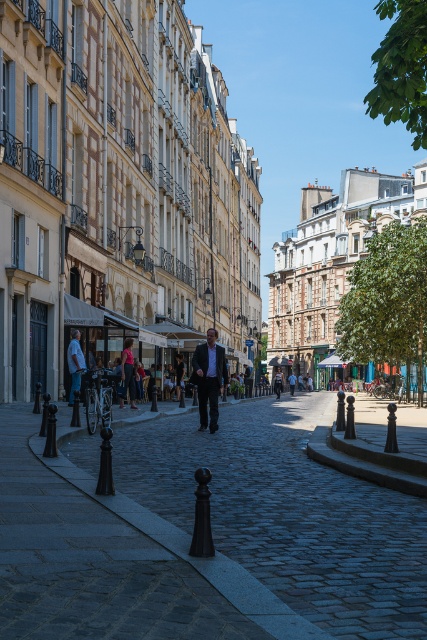
Identify the location of light blue shirt at left. This screenshot has width=427, height=640. (75, 364).

Between light blue shirt at left and denim jacket at center, which one has more height?

light blue shirt at left

Does point (70, 353) lie in front of point (277, 381)?

That is True.

Locate an element on the screen. This screenshot has height=640, width=427. light blue shirt at left is located at coordinates (75, 364).

Which is in front, point (131, 392) or point (294, 388)?

Point (131, 392)

Who is positioned more to the left, light brown leather jacket at center or light blue jeans at center?

light brown leather jacket at center is more to the left.

You are a GUI agent. You are given a task and a screenshot of the screen. Output one action in this format:
    pyautogui.click(x=<x>, y=<y>)
    Task: Click on the light brown leather jacket at center
    This screenshot has width=427, height=640.
    Given the screenshot: What is the action you would take?
    pyautogui.click(x=128, y=372)

Is dark gray suit at center behind light blue jeans at center?

No, it is not.

Does dark gray suit at center have a lesser width compared to light blue jeans at center?

Yes.

Between point (195, 371) and point (289, 378), which one is positioned in front?

Positioned in front is point (195, 371).

Identify the location of dark gray suit at center. (208, 378).